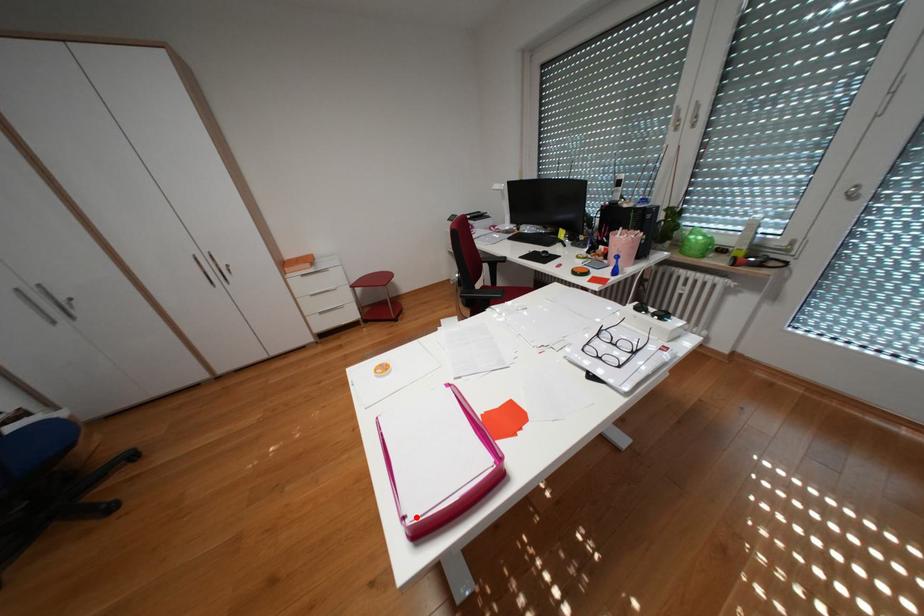
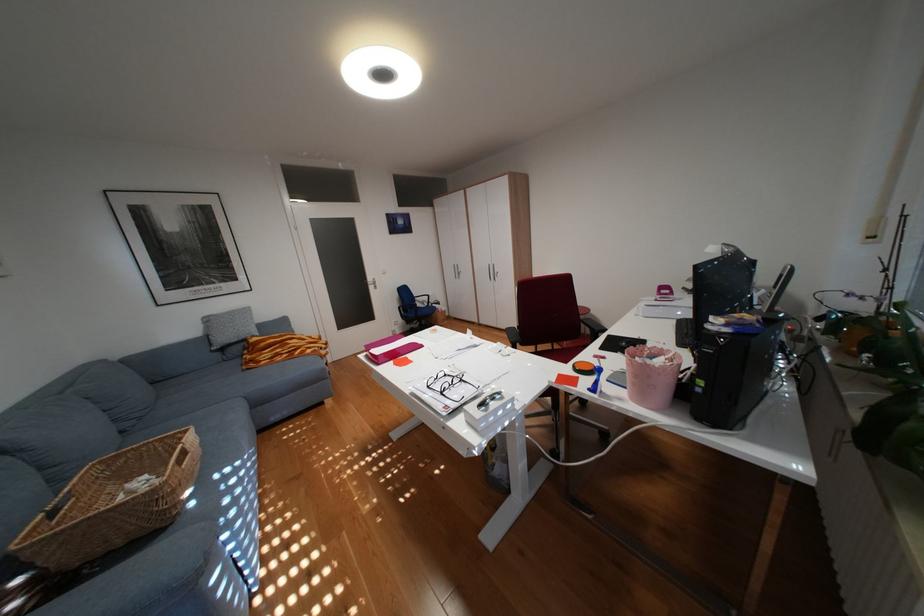
In the second image, find the point that corresponds to the highlighted location in the first image.

(383, 350)